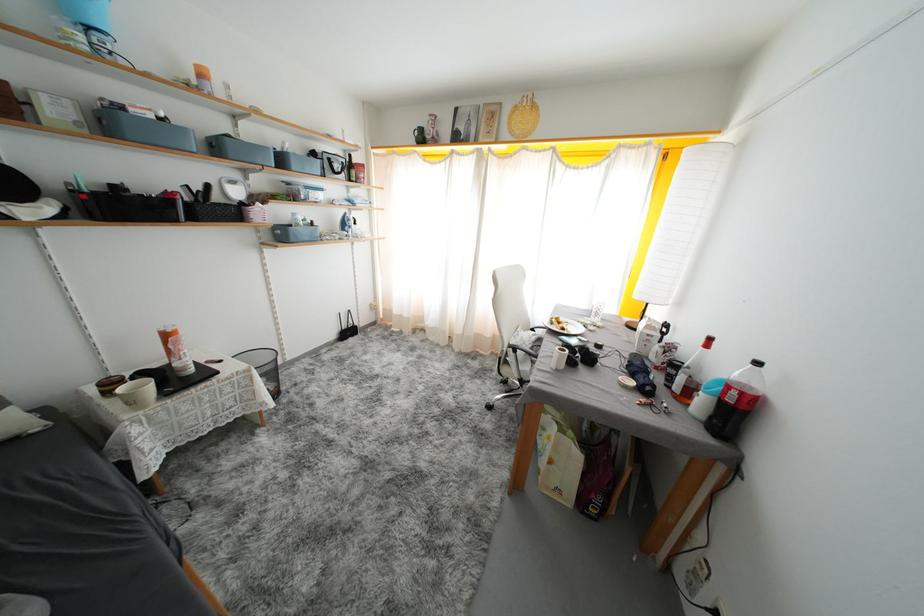
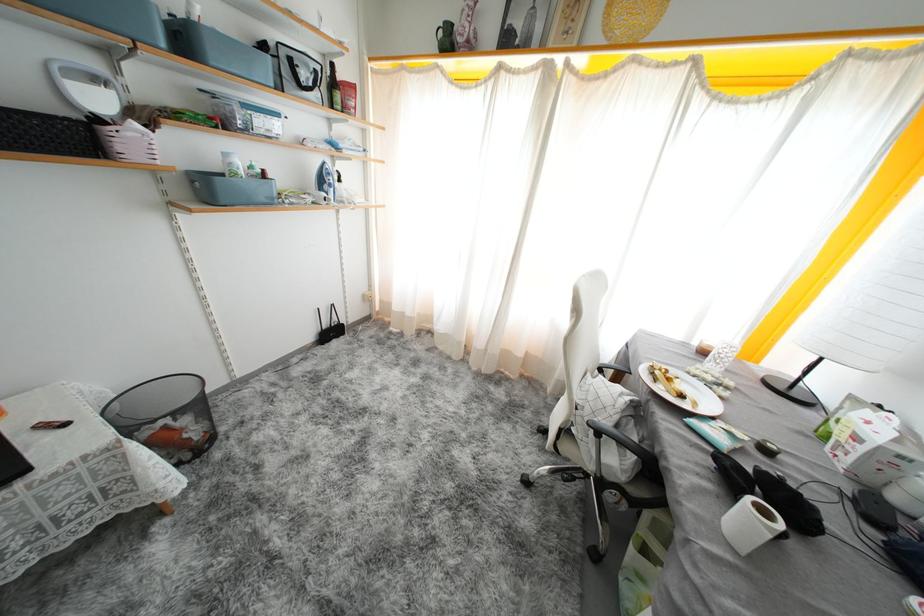
Find the pixel in the second image that matches point 264,208 in the first image.

(141, 129)